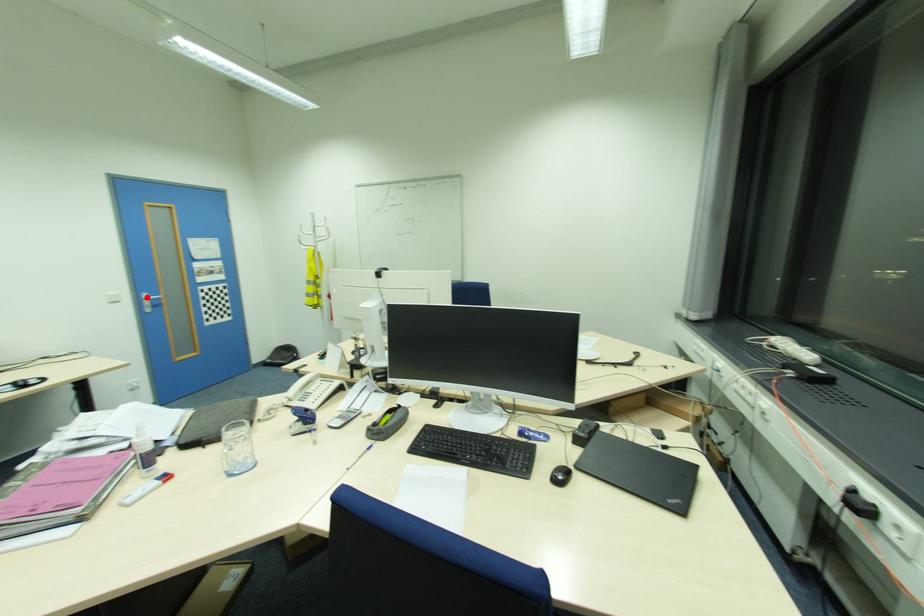
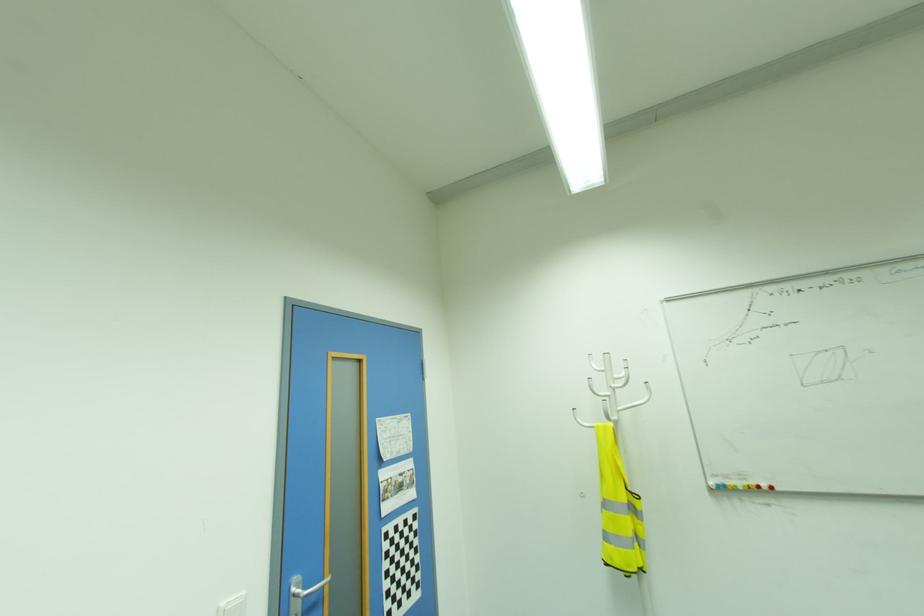
Where in the second image is the point corresponding to the highlighted location from the first image?

(296, 590)